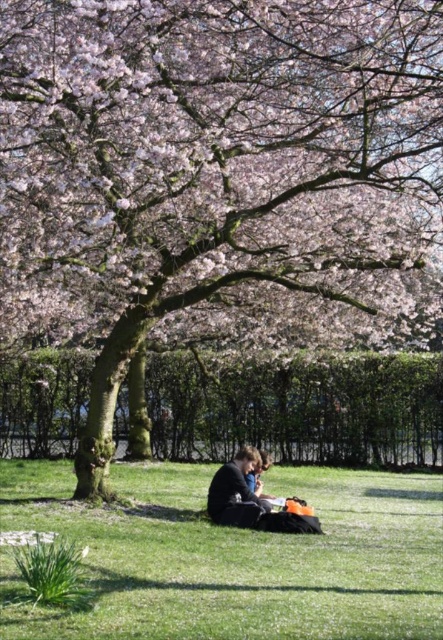
Question: Which of the following is the closest to the observer?

Choices:
 (A) tap(255, 515)
 (B) tap(197, 600)

Answer: (B)

Question: Does green grass at center appear on the left side of matte black jacket at center?

Choices:
 (A) yes
 (B) no

Answer: (A)

Question: Among these objects, which one is nearest to the camera?

Choices:
 (A) matte black jacket at center
 (B) green grass at center

Answer: (B)

Question: Does green grass at center appear under matte black jacket at center?

Choices:
 (A) no
 (B) yes

Answer: (B)

Question: Which point is closer to the camera?

Choices:
 (A) (261, 611)
 (B) (221, 500)

Answer: (A)

Question: Where is green grass at center located in relation to matte black jacket at center in the image?

Choices:
 (A) left
 (B) right

Answer: (A)